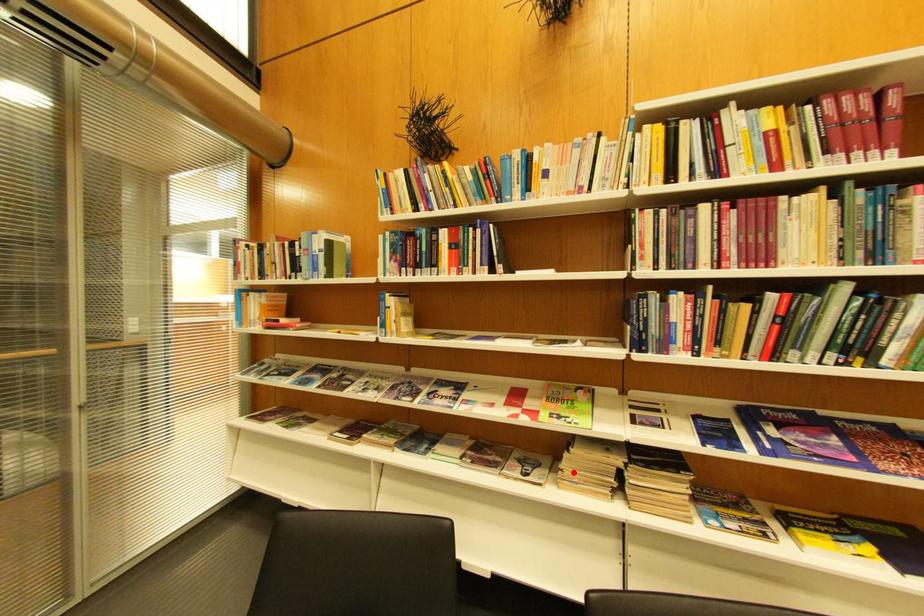
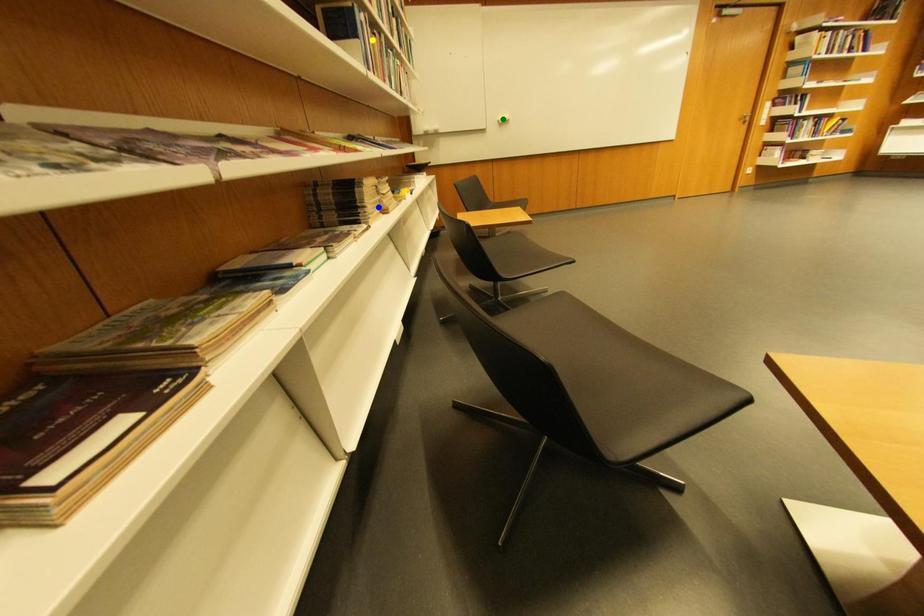
Question: I am providing you with two images of the same scene from different viewpoints. A red point is marked on the first image. You are given multiple points on the second image. Which point in image 2 represents the same 3d spot as the red point in image 1?

Choices:
 (A) green point
 (B) yellow point
 (C) blue point

Answer: (C)